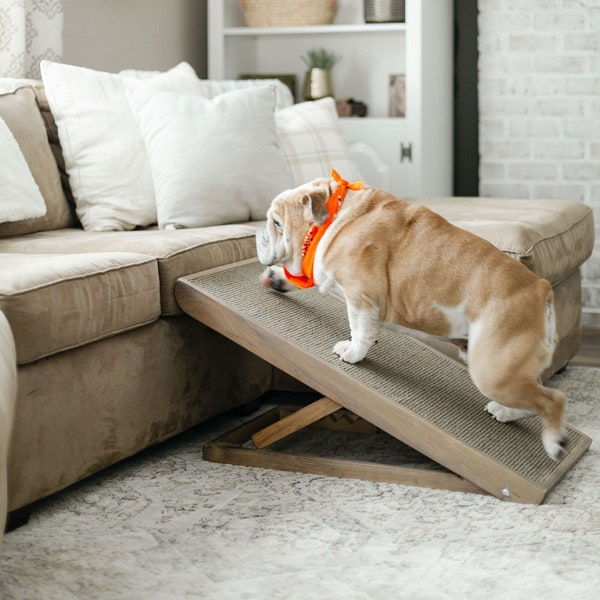
This screenshot has width=600, height=600. Identify the location of pillow. (324, 137), (240, 152), (122, 106), (15, 183), (40, 124).